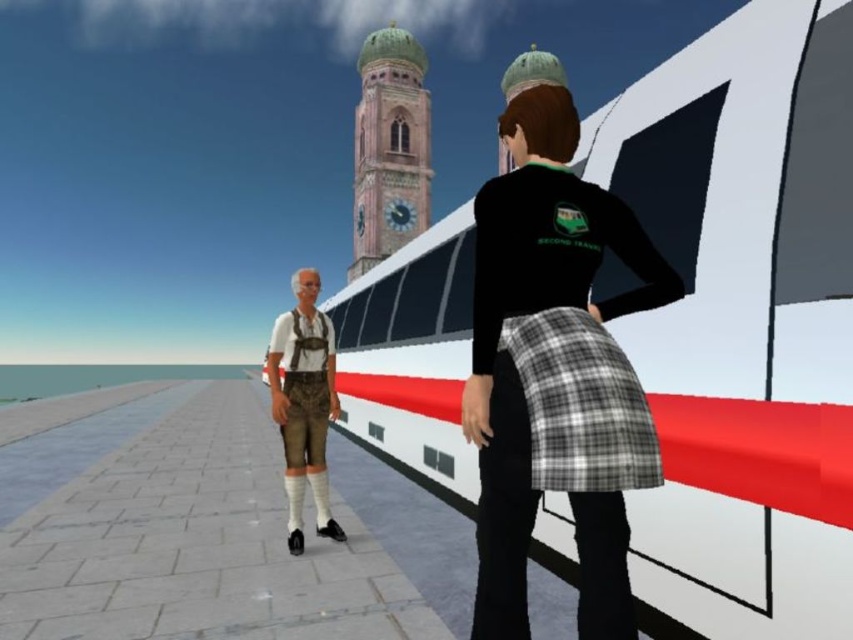
Question: Which object is positioned closest to the white glossy train at center?

Choices:
 (A) gray plaid kilt at center
 (B) black fabric skirt at center
 (C) leather brown leather pants at center

Answer: (C)

Question: Is green stone clock tower at center below leather brown leather pants at center?

Choices:
 (A) yes
 (B) no

Answer: (B)

Question: Where is black fabric skirt at center located in relation to green stone clock tower at center in the image?

Choices:
 (A) above
 (B) below

Answer: (B)

Question: Where is black fabric skirt at center located in relation to green stone clock tower at center in the image?

Choices:
 (A) above
 (B) below

Answer: (B)

Question: Which object is farther from the camera taking this photo?

Choices:
 (A) white glossy train at center
 (B) black fabric skirt at center
 (C) gray plaid kilt at center

Answer: (A)

Question: Estimate the real-world distances between objects in this image. Which object is farther from the white glossy train at center?

Choices:
 (A) camo fabric kilt at center
 (B) leather brown leather pants at center
 (C) green stone clock tower at center

Answer: (C)